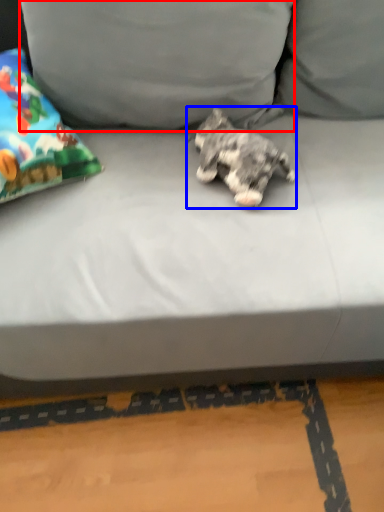
Question: Which of the following is the closest to the observer, pillow (highlighted by a red box) or dog (highlighted by a blue box)?

Choices:
 (A) pillow
 (B) dog

Answer: (A)